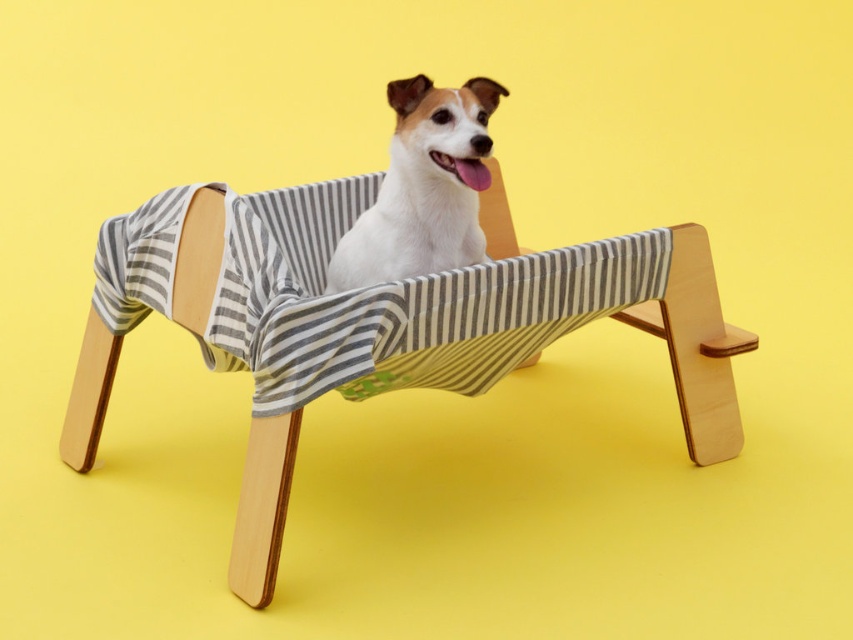
Is wooden striped beach chair at center closer to the viewer compared to white fabric dog bed at center?

Yes, wooden striped beach chair at center is in front of white fabric dog bed at center.

Who is more forward, (508, 248) or (421, 244)?

Point (421, 244) is in front.

Where is `wooden striped beach chair at center`? The width and height of the screenshot is (853, 640). wooden striped beach chair at center is located at coordinates (697, 348).

What are the coordinates of `wooden striped beach chair at center` in the screenshot? It's located at (697, 348).